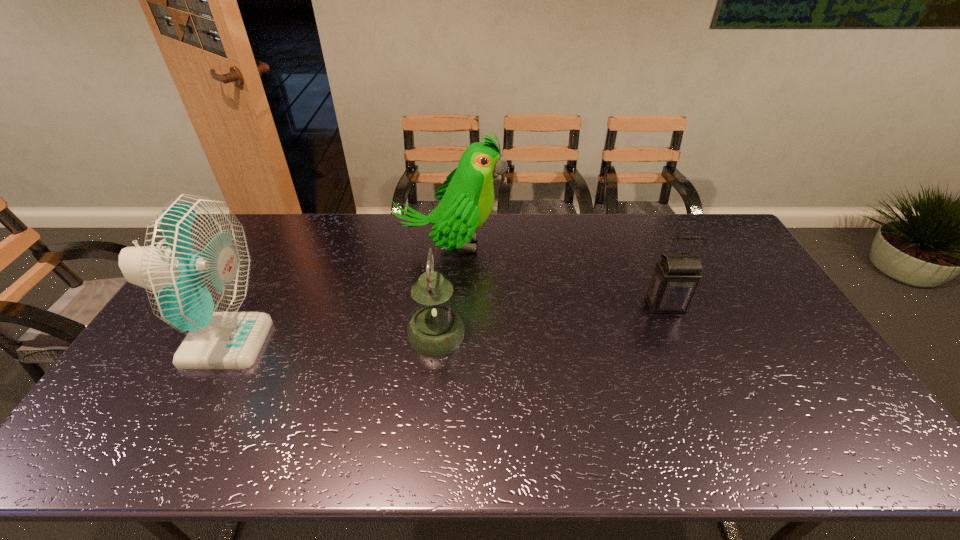
The width and height of the screenshot is (960, 540). Identify the location of the leftmost object. (195, 264).

You are a GUI agent. You are given a task and a screenshot of the screen. Output one action in this format:
    pyautogui.click(x=<x>, y=<y>)
    Task: Click on the farthest object
    The width and height of the screenshot is (960, 540).
    Given the screenshot: What is the action you would take?
    pyautogui.click(x=466, y=197)

This screenshot has width=960, height=540. Identify the location of the left lantern. [x=435, y=330].

The image size is (960, 540). I want to click on the right lantern, so click(x=676, y=276).

I want to click on vacant region located 0.250m in front of the leftmost object to face the airflow, so click(353, 342).

Image resolution: width=960 pixels, height=540 pixels. In order to click on free space located on the beak of the farthest object in this screenshot , I will do `click(521, 246)`.

Find the location of `vacant region located on the back of the left lantern`. vacant region located on the back of the left lantern is located at coordinates (441, 291).

At what (x,y) coordinates should I click in order to perform the action: click on vacant position located 0.110m on the front-facing side of the right lantern. Please return your answer as a coordinate pair (x, y). The image size is (960, 540). Looking at the image, I should click on (682, 344).

I want to click on object that is at the far edge, so click(x=466, y=197).

The image size is (960, 540). What are the coordinates of `object at the left edge` in the screenshot? It's located at (195, 264).